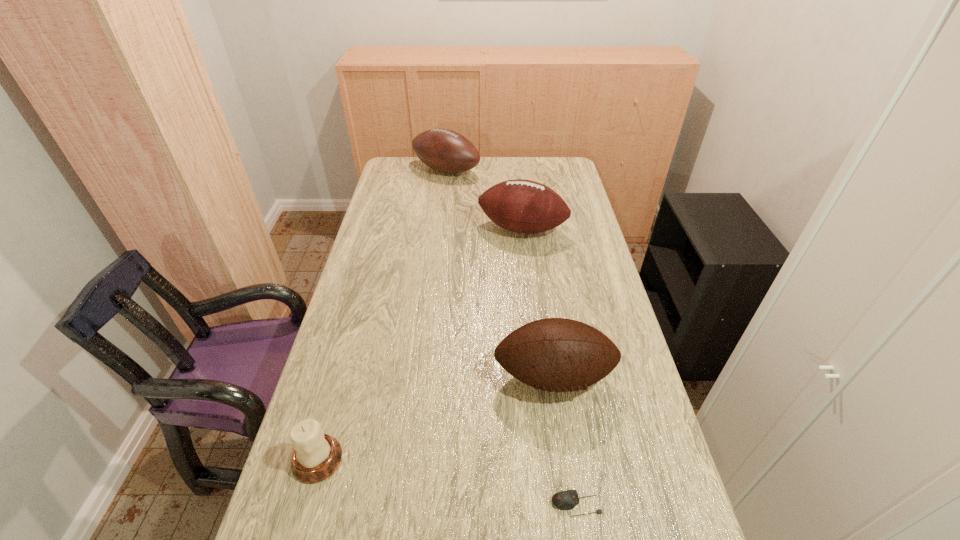
Identify the location of football that stands as the closest to the nearest football. (523, 206).

Locate an element on the screen. free space in the image that satisfies the following two spatial constraints: 1. on the front side of the nearest object; 2. on the left side of the second nearest football is located at coordinates (555, 504).